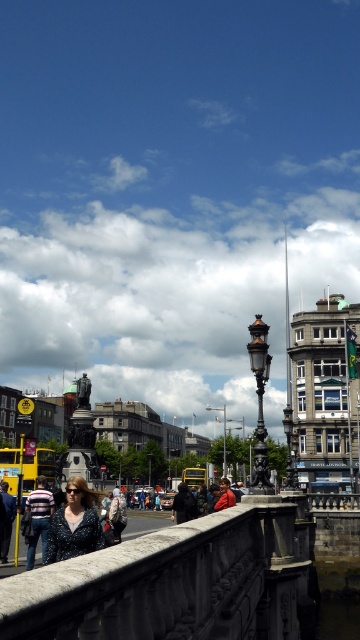
Question: Can you confirm if striped sweater at center is positioned above red fabric jacket at center?

Choices:
 (A) no
 (B) yes

Answer: (B)

Question: Among these objects, which one is farthest from the camera?

Choices:
 (A) striped sweater at center
 (B) denim jacket at lower center

Answer: (B)

Question: Which of the following is the closest to the observer?

Choices:
 (A) (119, 515)
 (B) (264, 624)
 (C) (73, 525)
 (D) (54, 509)

Answer: (B)

Question: Which point is farther from the camera taking this photo?

Choices:
 (A) (29, 468)
 (B) (43, 502)

Answer: (A)

Question: Is the position of denim jacket at lower center less distant than that of yellow rubber duck at lower center?

Choices:
 (A) no
 (B) yes

Answer: (B)

Question: Is denim jacket at lower center below red fabric jacket at center?

Choices:
 (A) yes
 (B) no

Answer: (B)